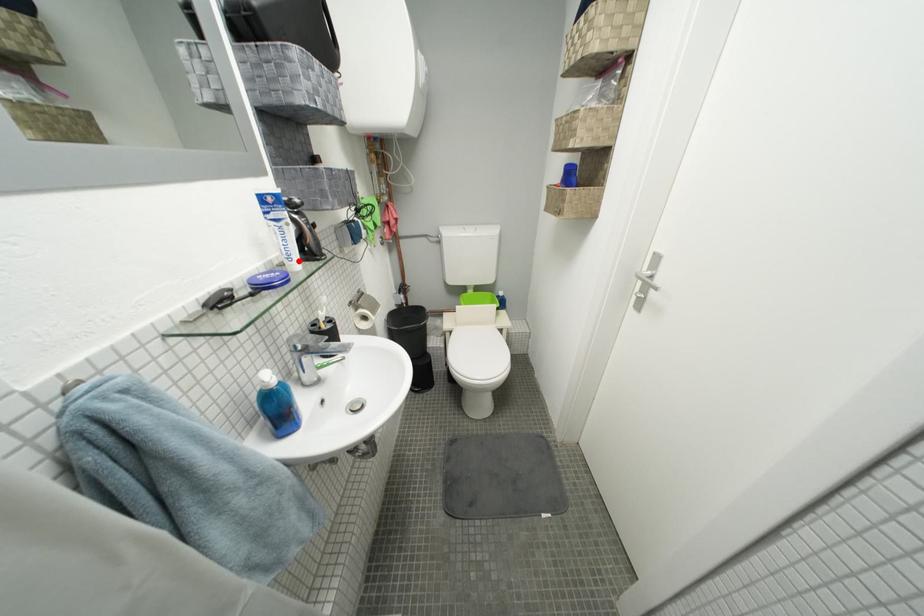
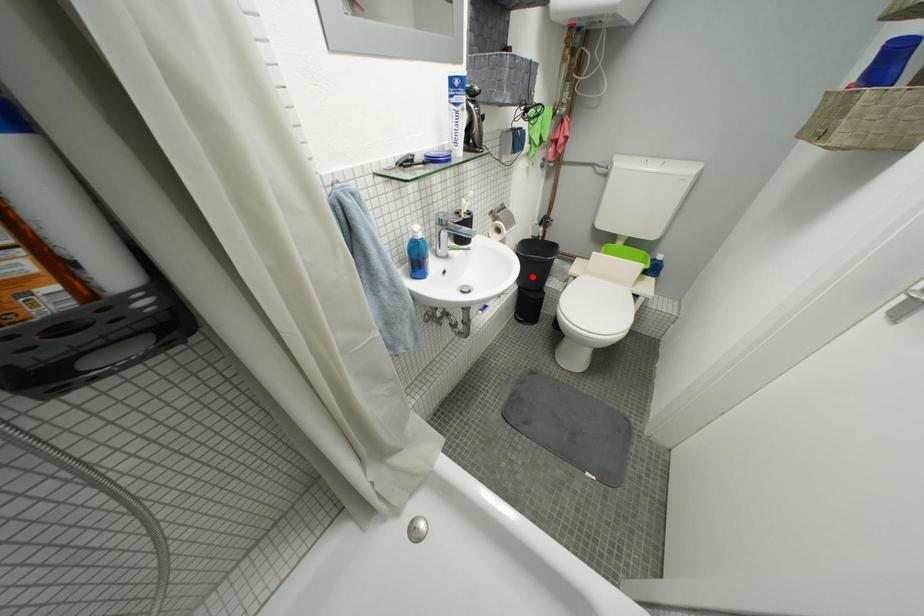
I am providing you with two images of the same scene from different viewpoints. A red point is marked on the first image and another point is marked on the second image. Does the point marked in image1 correspond to the same location as the one in image2?

No